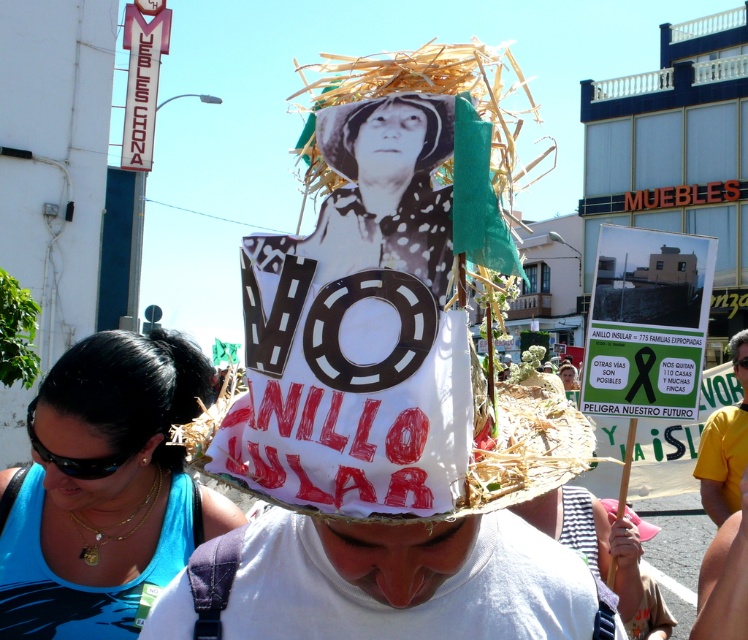
Between point (208, 394) and point (352, 160), which one is positioned in front?

Positioned in front is point (352, 160).

Can you confirm if blue fabric at lower left is smaller than black paper head at center?

Incorrect, blue fabric at lower left is not smaller in size than black paper head at center.

Which is behind, point (49, 627) or point (340, 172)?

The point (49, 627) is behind.

Where is `blue fabric at lower left`? The image size is (748, 640). blue fabric at lower left is located at coordinates (105, 490).

Between point (108, 472) and point (729, 337), which one is positioned in front?

Positioned in front is point (108, 472).

Who is shorter, black plastic goggles at lower left or shiny gold sunglasses at lower center?

Standing shorter between the two is black plastic goggles at lower left.

The width and height of the screenshot is (748, 640). I want to click on black plastic goggles at lower left, so click(76, 458).

The image size is (748, 640). Find the location of `black plastic goggles at lower left`. black plastic goggles at lower left is located at coordinates (76, 458).

Who is shorter, yellow fabric shirt at center or black plastic goggles at lower left?

black plastic goggles at lower left

The image size is (748, 640). What do you see at coordinates (723, 445) in the screenshot?
I see `yellow fabric shirt at center` at bounding box center [723, 445].

Is point (729, 509) positioned behind point (64, 472)?

Yes, it is behind point (64, 472).

Find the location of `yellow fabric shirt at center`. yellow fabric shirt at center is located at coordinates (723, 445).